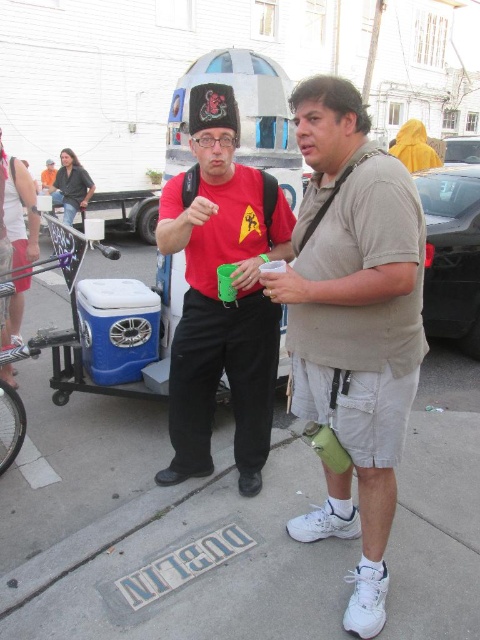
Question: Which of the following is the farthest from the observer?

Choices:
 (A) matte red shirt at center
 (B) concrete sidewalk at center
 (C) green fabric water bottle at center
 (D) blue plastic cooler at center

Answer: (D)

Question: Can you confirm if green fabric water bottle at center is positioned to the left of matte red shirt at center?

Choices:
 (A) no
 (B) yes

Answer: (A)

Question: Which object appears closest to the camera in this image?

Choices:
 (A) blue plastic cooler at center
 (B) concrete sidewalk at center

Answer: (B)

Question: Does matte red shirt at center have a greater width compared to blue plastic cooler at center?

Choices:
 (A) no
 (B) yes

Answer: (A)

Question: Which object is the farthest from the blue plastic cooler at center?

Choices:
 (A) green fabric water bottle at center
 (B) concrete sidewalk at center
 (C) matte red shirt at center

Answer: (A)

Question: Is matte red shirt at center wider than blue plastic cooler at center?

Choices:
 (A) yes
 (B) no

Answer: (B)